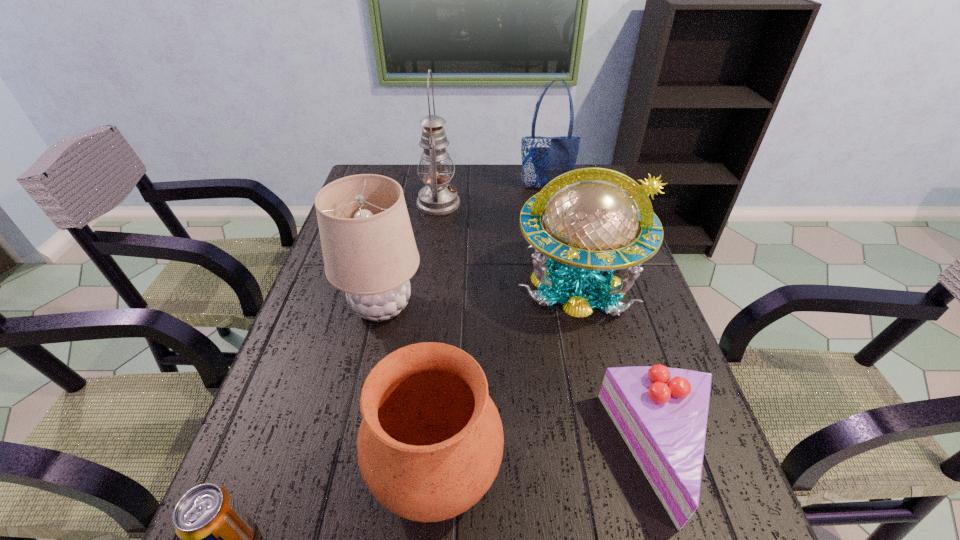
Where is `oil lamp`? The height and width of the screenshot is (540, 960). oil lamp is located at coordinates (438, 198).

This screenshot has height=540, width=960. Identify the location of shopping bag. (543, 158).

This screenshot has width=960, height=540. I want to click on globe, so click(591, 216).

Find the location of a particular element. This screenshot has width=960, height=540. lampshade is located at coordinates (369, 250).

Where is `cake`? The height and width of the screenshot is (540, 960). cake is located at coordinates (661, 412).

At what (x,y) coordinates should I click in order to perform the action: click on free space located 0.140m on the back of the oil lamp. Please return your answer as a coordinate pair (x, y). This screenshot has height=540, width=960. Looking at the image, I should click on (443, 169).

Identify the location of vacant position located 0.360m on the front-facing side of the shopping bag. (561, 258).

The height and width of the screenshot is (540, 960). Find the location of `vacant space located 0.150m on the left of the globe`. vacant space located 0.150m on the left of the globe is located at coordinates (458, 283).

Identify the location of vacant area located 0.390m on the back of the lampshade. (407, 199).

Image resolution: width=960 pixels, height=540 pixels. What are the coordinates of `vacant space located on the left of the cake` in the screenshot? It's located at (551, 455).